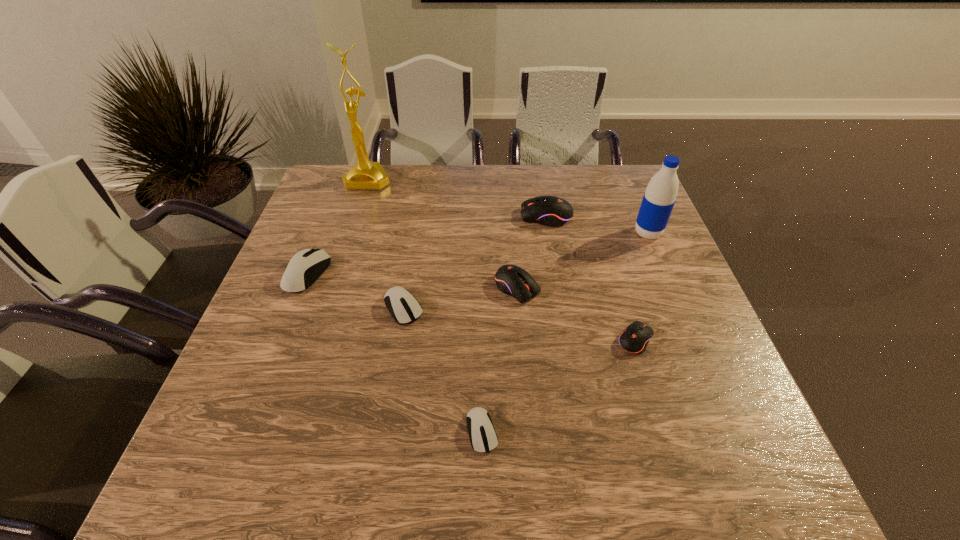
This screenshot has width=960, height=540. Find the location of `golden award`. golden award is located at coordinates (368, 175).

The width and height of the screenshot is (960, 540). I want to click on award, so click(368, 175).

Locate an element on the screen. The height and width of the screenshot is (540, 960). water bottle is located at coordinates (659, 198).

What are the coordinates of `the rightmost object` in the screenshot? It's located at (659, 198).

Locate an element on the screen. This screenshot has width=960, height=540. the farthest black computer mouse is located at coordinates (552, 211).

Find the location of a particular element. The height and width of the screenshot is (540, 960). the tallest mouse is located at coordinates (552, 211).

Where is `the biggest white mouse`? the biggest white mouse is located at coordinates (306, 266).

The image size is (960, 540). What are the coordinates of `the leftmost mouse` in the screenshot? It's located at (306, 266).

At what (x,y) coordinates should I click in order to perform the action: click on the second biggest black computer mouse. Please return your answer as a coordinate pair (x, y). Image resolution: width=960 pixels, height=540 pixels. Looking at the image, I should click on (512, 280).

The height and width of the screenshot is (540, 960). What are the coordinates of `the second biggest white mouse` in the screenshot? It's located at click(403, 306).